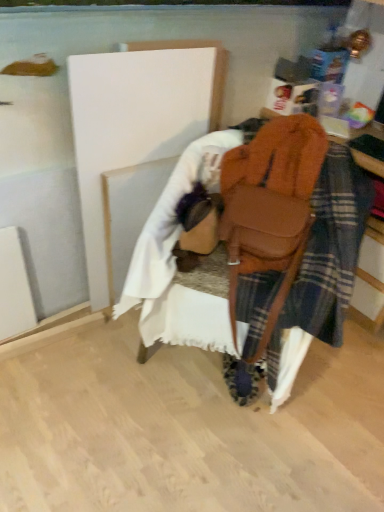
Question: Based on their positions, is white painted wood at center, positioned as the first wood in top-to-bottom order, located to the left or right of brown leather bag at center?

Choices:
 (A) left
 (B) right

Answer: (A)

Question: Choose the correct answer: Is white painted wood at center, acting as the second wood starting from the bottom, inside brown leather bag at center or outside it?

Choices:
 (A) outside
 (B) inside

Answer: (A)

Question: Which object is the farthest from the brown leather bag at center?

Choices:
 (A) white fabric at lower center, marked as the second wood in a top-to-bottom arrangement
 (B) white painted wood at center, positioned as the first wood in top-to-bottom order

Answer: (A)

Question: Estimate the real-world distances between objects in this image. Which object is farther from the white fabric at lower center, marked as the second wood in a top-to-bottom arrangement?

Choices:
 (A) white painted wood at center, positioned as the first wood in top-to-bottom order
 (B) brown leather bag at center

Answer: (B)